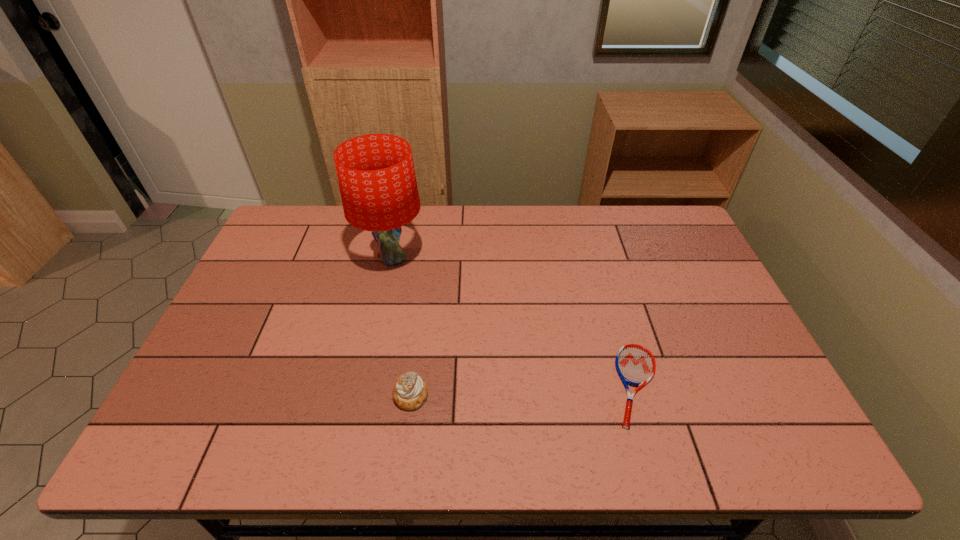
Locate an element on the screen. This screenshot has height=540, width=960. the farthest object is located at coordinates (376, 175).

Identify the location of lampshade. This screenshot has width=960, height=540. (376, 175).

Where is `the second shortest object`? The height and width of the screenshot is (540, 960). the second shortest object is located at coordinates (410, 392).

Where is `the shortest object`? The width and height of the screenshot is (960, 540). the shortest object is located at coordinates (635, 365).

Locate an element on the screen. the rightmost object is located at coordinates (635, 365).

Identify the location of free space located 0.380m on the front-facing side of the lampshade. The width and height of the screenshot is (960, 540). pos(363,393).

The width and height of the screenshot is (960, 540). Identify the location of vacant region located on the left of the second shortest object. (344, 395).

Where is `free region located on the left of the tennis racket`? Image resolution: width=960 pixels, height=540 pixels. free region located on the left of the tennis racket is located at coordinates (460, 385).

Locate an element on the screen. The image size is (960, 540). object that is at the far edge is located at coordinates point(376,175).

This screenshot has height=540, width=960. In order to click on object that is positioned at the near edge in this screenshot , I will do `click(635, 365)`.